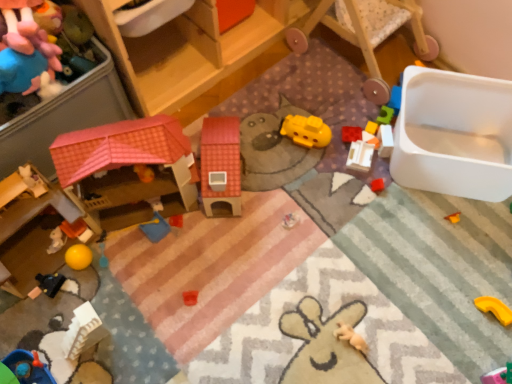
The width and height of the screenshot is (512, 384). I want to click on free area in between yellow matte submarine at center, which is the 5th toy in left-to-right order, and matte plastic dollhouse at center-left, the fourth toy viewed from the left, so click(x=271, y=164).